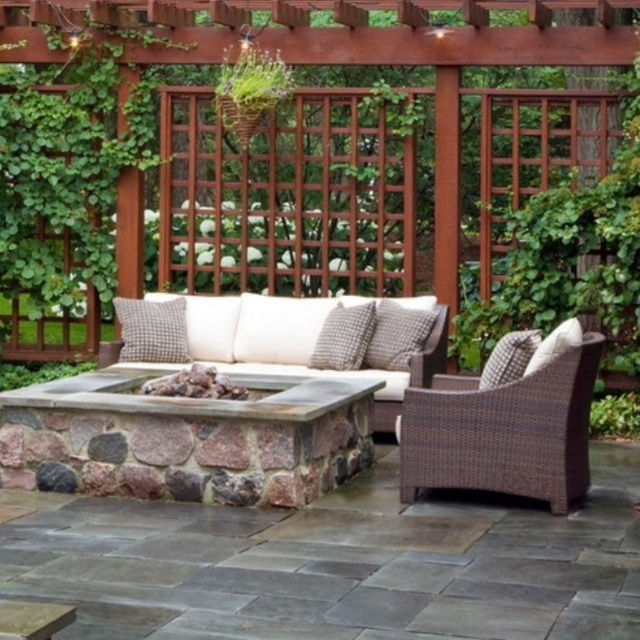
Can you confirm if brown wicker sofa at center is taller than gray woven pillow at center?

Yes, brown wicker sofa at center is taller than gray woven pillow at center.

Where is `brown wicker sofa at center`? The image size is (640, 640). brown wicker sofa at center is located at coordinates (301, 342).

Locate an element on the screen. The height and width of the screenshot is (640, 640). brown wicker sofa at center is located at coordinates (301, 342).

Does checkered fabric pillow at center appear over white textured pillow at right?

Yes, checkered fabric pillow at center is above white textured pillow at right.

Does checkered fabric pillow at center have a greater height compared to white textured pillow at right?

Correct, checkered fabric pillow at center is much taller as white textured pillow at right.

Is point (376, 352) farther from viewer compared to point (568, 332)?

Yes, it is.

This screenshot has height=640, width=640. Find the location of `checkered fabric pillow at center`. checkered fabric pillow at center is located at coordinates (x=396, y=336).

Who is taller, gray woven pillow at center or woven fabric pillow at right?

Standing taller between the two is gray woven pillow at center.

Is gray woven pillow at center positioned at the back of woven fabric pillow at right?

Yes, gray woven pillow at center is behind woven fabric pillow at right.

Find the location of a particular element. gray woven pillow at center is located at coordinates (152, 330).